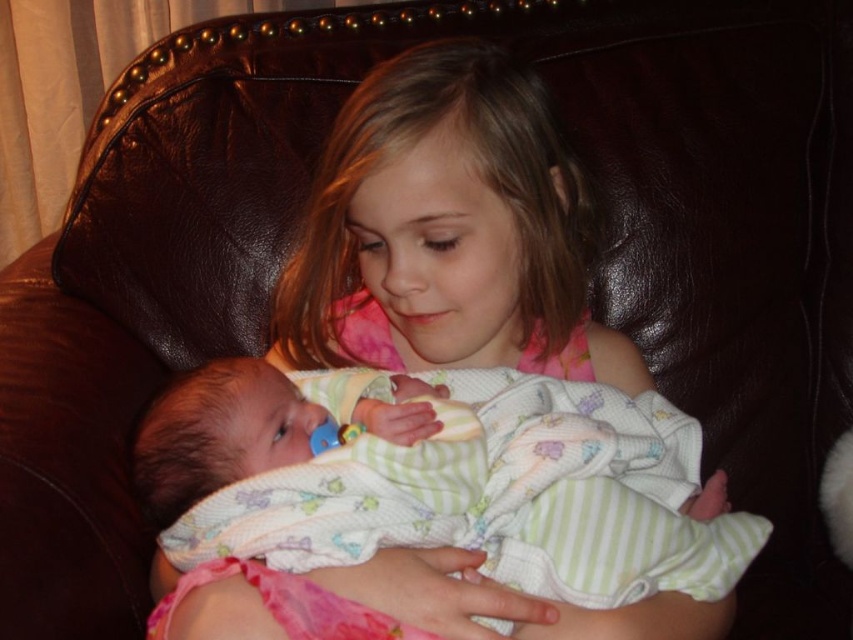
You are a photographer trying to capture a closeup of the soft green fabric baby at center without the pink fabric dress at center blocking the view. Can you adjust your position to do so?

The pink fabric dress at center is in front of the soft green fabric baby at center, so you need to move your camera position behind the pink fabric dress at center to capture the baby without obstruction.

You are a photographer setting up for a family photo. You need to ensure both the pink fabric dress at center and the soft green fabric baby at center are visible in the frame. Given their sizes, which object should you focus on first to ensure proper framing?

The pink fabric dress at center is larger than the soft green fabric baby at center, so you should focus on the pink fabric dress at center first to ensure it fits well in the frame before adjusting for the smaller baby.